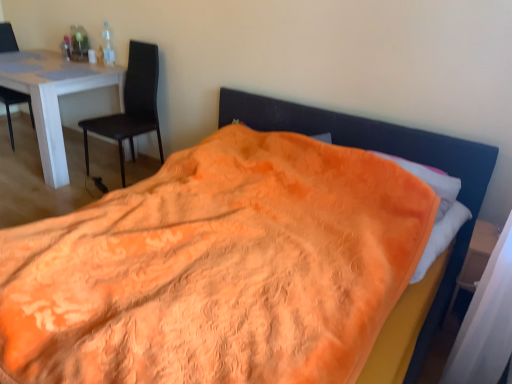
Question: Is matte black chair at left, placed as the 2th chair when sorted from right to left, at the left side of wooden at right?

Choices:
 (A) yes
 (B) no

Answer: (A)

Question: Can you confirm if matte black chair at left, placed as the 2th chair when sorted from right to left, is positioned to the right of wooden at right?

Choices:
 (A) no
 (B) yes

Answer: (A)

Question: Is matte black chair at left, placed as the 2th chair when sorted from right to left, closer to camera compared to wooden at right?

Choices:
 (A) yes
 (B) no

Answer: (B)

Question: Can you confirm if matte black chair at left, which is the 1th chair in left-to-right order, is smaller than wooden at right?

Choices:
 (A) no
 (B) yes

Answer: (A)

Question: Can you confirm if matte black chair at left, placed as the 2th chair when sorted from right to left, is bigger than wooden at right?

Choices:
 (A) yes
 (B) no

Answer: (A)

Question: Would you say white glossy table at left is inside or outside wooden at right?

Choices:
 (A) outside
 (B) inside

Answer: (A)

Question: Looking at their shapes, would you say white glossy table at left is wider or thinner than wooden at right?

Choices:
 (A) thin
 (B) wide

Answer: (B)

Question: From the image's perspective, is white glossy table at left above or below wooden at right?

Choices:
 (A) above
 (B) below

Answer: (A)

Question: In the image, is white glossy table at left positioned in front of or behind wooden at right?

Choices:
 (A) behind
 (B) front

Answer: (A)

Question: Is point (478, 263) closer or farther from the camera than point (87, 150)?

Choices:
 (A) closer
 (B) farther

Answer: (A)

Question: Is wooden at right bigger or smaller than matte black chair at left, which appears as the second chair when viewed from the left?

Choices:
 (A) small
 (B) big

Answer: (A)

Question: From the image's perspective, is wooden at right above or below matte black chair at left, which appears as the second chair when viewed from the left?

Choices:
 (A) above
 (B) below

Answer: (B)

Question: Is wooden at right situated inside matte black chair at left, which appears as the second chair when viewed from the left, or outside?

Choices:
 (A) outside
 (B) inside

Answer: (A)

Question: Considering the positions of white glossy table at left and matte black chair at left, which appears as the second chair when viewed from the left, in the image, is white glossy table at left wider or thinner than matte black chair at left, which appears as the second chair when viewed from the left,?

Choices:
 (A) thin
 (B) wide

Answer: (B)

Question: From the image's perspective, is white glossy table at left located above or below matte black chair at left, which appears as the second chair when viewed from the left?

Choices:
 (A) above
 (B) below

Answer: (A)